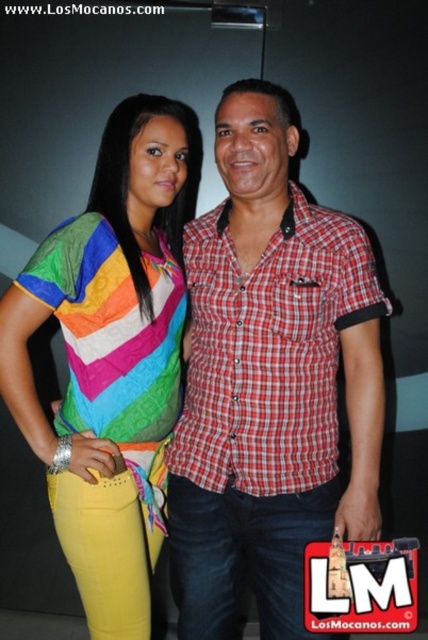
Question: Among these points, which one is nearest to the camera?

Choices:
 (A) (329, 362)
 (B) (165, 285)

Answer: (A)

Question: Can you confirm if red checkered shirt at center is wider than rainbow fabric shirt at center?

Choices:
 (A) yes
 (B) no

Answer: (A)

Question: In this image, where is red checkered shirt at center located relative to rainbow fabric shirt at center?

Choices:
 (A) below
 (B) above

Answer: (B)

Question: Is red checkered shirt at center below rainbow fabric shirt at center?

Choices:
 (A) yes
 (B) no

Answer: (B)